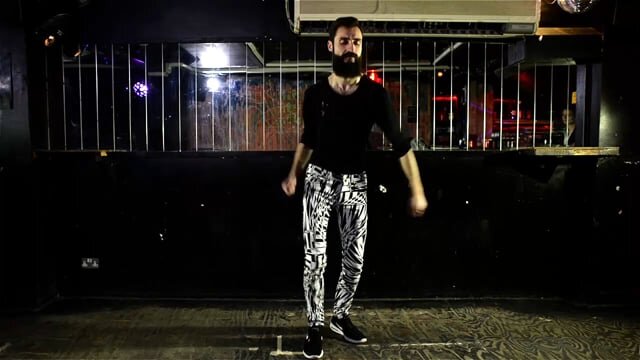
Locate an element on the screen. The width and height of the screenshot is (640, 360). aircon unit is located at coordinates (492, 14), (365, 15).